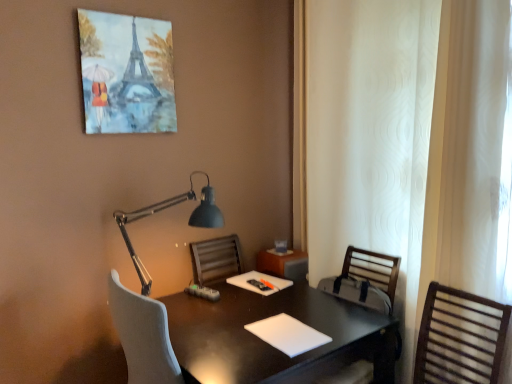
Locate an element on the screen. The width and height of the screenshot is (512, 384). free space above white matte notepad at center, the 1th notepad from the top (from a real-world perspective) is located at coordinates (258, 278).